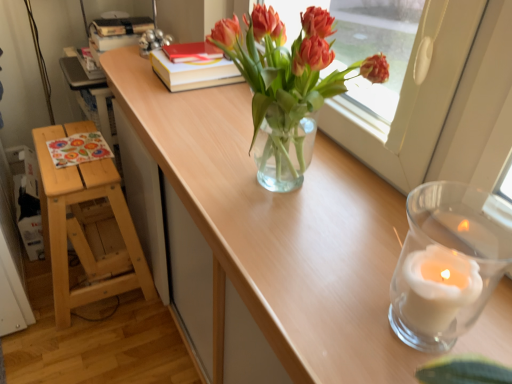
Question: Should I look upward or downward to see translucent glass vase at center?

Choices:
 (A) down
 (B) up

Answer: (B)

Question: Can you confirm if clear wood table at center is positioned to the left of translucent glass vase at center?

Choices:
 (A) yes
 (B) no

Answer: (A)

Question: Is clear wood table at center oriented towards translucent glass vase at center?

Choices:
 (A) no
 (B) yes

Answer: (A)

Question: From a real-world perspective, is clear wood table at center on top of translucent glass vase at center?

Choices:
 (A) no
 (B) yes

Answer: (A)

Question: Can you confirm if clear wood table at center is thinner than translucent glass vase at center?

Choices:
 (A) yes
 (B) no

Answer: (B)

Question: Is clear wood table at center taller than translucent glass vase at center?

Choices:
 (A) no
 (B) yes

Answer: (A)

Question: Is clear wood table at center wider than translucent glass vase at center?

Choices:
 (A) no
 (B) yes

Answer: (B)

Question: From a real-world perspective, is translucent glass vase at center located higher than clear wood table at center?

Choices:
 (A) yes
 (B) no

Answer: (A)

Question: Is translucent glass vase at center behind clear wood table at center?

Choices:
 (A) no
 (B) yes

Answer: (B)

Question: From the image's perspective, is translucent glass vase at center beneath clear wood table at center?

Choices:
 (A) yes
 (B) no

Answer: (B)

Question: Does translucent glass vase at center have a lesser width compared to clear wood table at center?

Choices:
 (A) no
 (B) yes

Answer: (B)

Question: Can we say translucent glass vase at center lies outside clear wood table at center?

Choices:
 (A) no
 (B) yes

Answer: (B)

Question: Is translucent glass vase at center not close to clear wood table at center?

Choices:
 (A) no
 (B) yes

Answer: (A)

Question: Is clear wood table at center located outside natural wood stool at left?

Choices:
 (A) no
 (B) yes

Answer: (B)